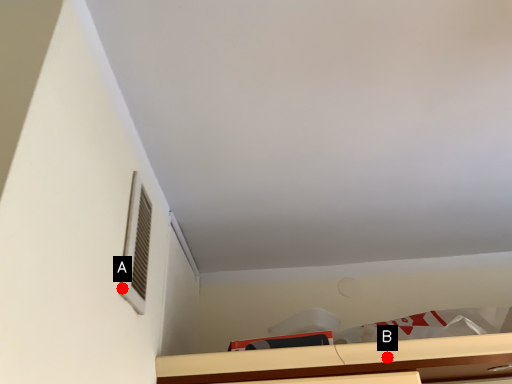
Question: Two points are circled on the image, labeled by A and B beside each circle. Which of the following is the farthest from the observer?

Choices:
 (A) A is further
 (B) B is further

Answer: (B)